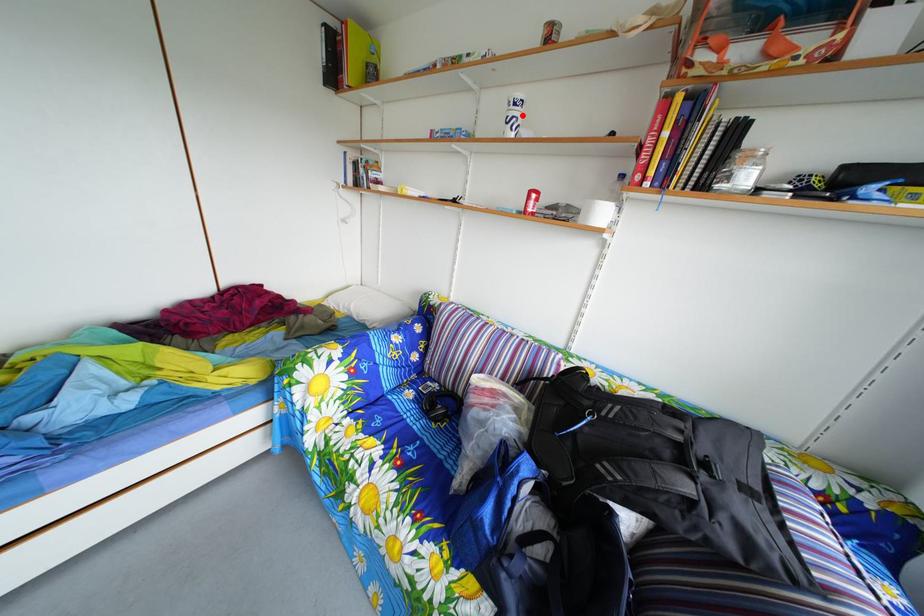
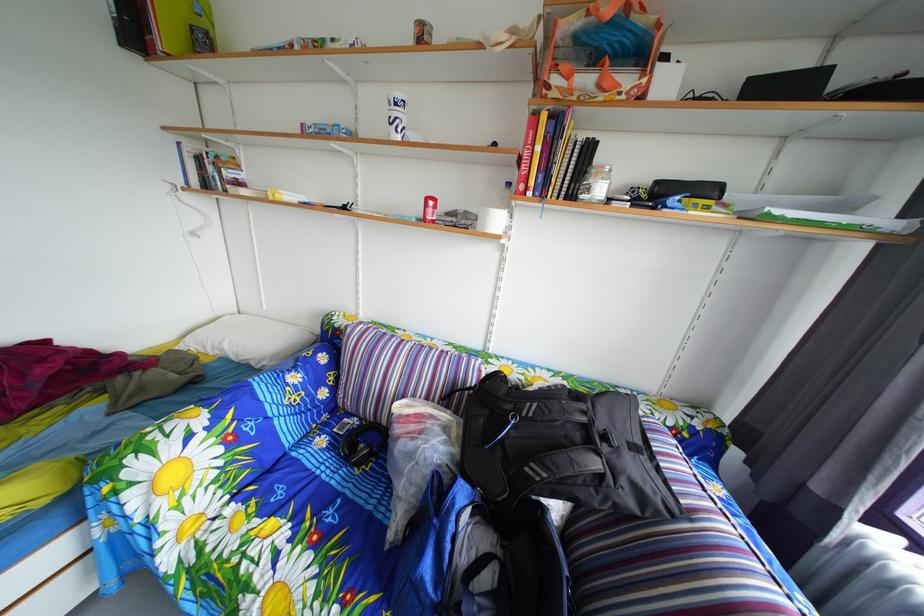
Where in the second image is the point corresponding to the highlighted location from the first image?

(404, 116)